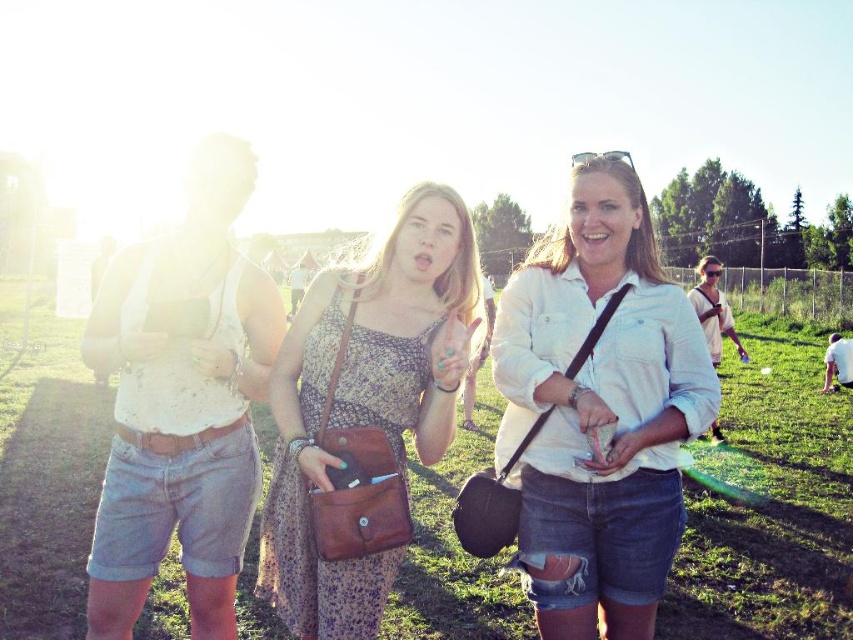
Question: Can you confirm if white cotton shirt at center is bigger than leather purse at center?

Choices:
 (A) yes
 (B) no

Answer: (A)

Question: Based on their relative distances, which object is nearer to the green grass at center?

Choices:
 (A) leather purse at center
 (B) white cotton shirt at center
 (C) white cotton tank top at left

Answer: (A)

Question: Does green grass at center appear over leather purse at center?

Choices:
 (A) no
 (B) yes

Answer: (A)

Question: Is leather purse at center thinner than white cotton tank top at left?

Choices:
 (A) no
 (B) yes

Answer: (A)

Question: Which object is positioned closest to the leather purse at center?

Choices:
 (A) white cotton tank top at left
 (B) green grass at center

Answer: (A)

Question: Which of the following is the closest to the observer?

Choices:
 (A) (21, 429)
 (B) (561, 593)
 (C) (459, 216)
 (D) (219, 310)

Answer: (B)